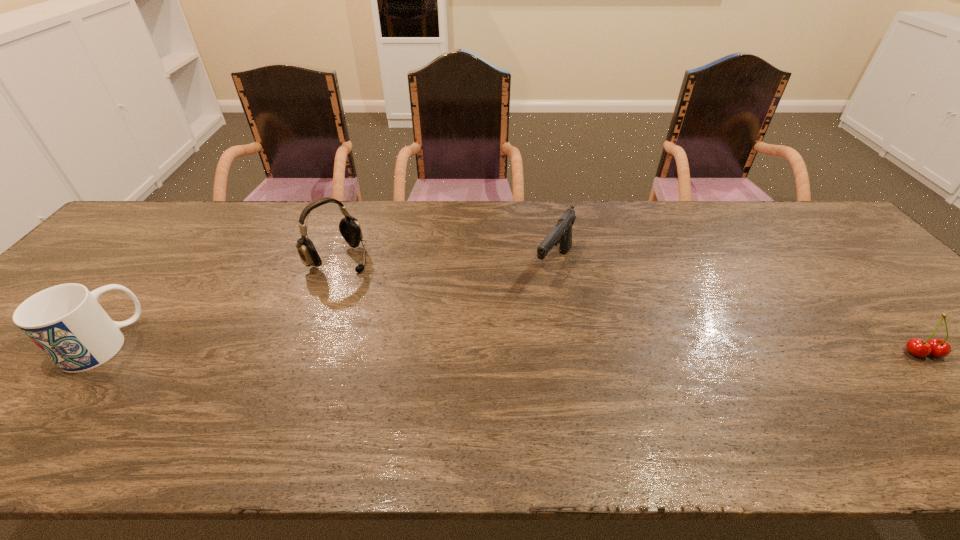
Identify the location of free space located 0.190m at the muzzle of the third object from left to right. The width and height of the screenshot is (960, 540). (581, 348).

Find the location of `free space located 0.320m at the muzzle of the third object from left to right`. free space located 0.320m at the muzzle of the third object from left to right is located at coordinates (x=597, y=396).

What are the coordinates of `vacant space located at the muzzle of the third object from left to right` in the screenshot? It's located at (568, 314).

Locate an element on the screen. Image resolution: width=960 pixels, height=540 pixels. headset that is at the far edge is located at coordinates (350, 229).

Where is `gun at the far edge`? gun at the far edge is located at coordinates [x=561, y=234].

I want to click on object that is at the left edge, so click(x=66, y=322).

You are a GUI agent. You are given a task and a screenshot of the screen. Output one action in this format:
    pyautogui.click(x=<x>, y=<y>)
    Task: Click on the object situated at the right edge
    The width and height of the screenshot is (960, 540).
    Given the screenshot: What is the action you would take?
    click(939, 348)

The height and width of the screenshot is (540, 960). In the image, there is a desktop. Identify the location of vacant space at the far edge. (737, 204).

Find the location of a particular element. This screenshot has height=540, width=960. free point at the near edge is located at coordinates (217, 401).

The width and height of the screenshot is (960, 540). What are the coordinates of `vacant space at the right edge of the desktop` in the screenshot? It's located at (859, 262).